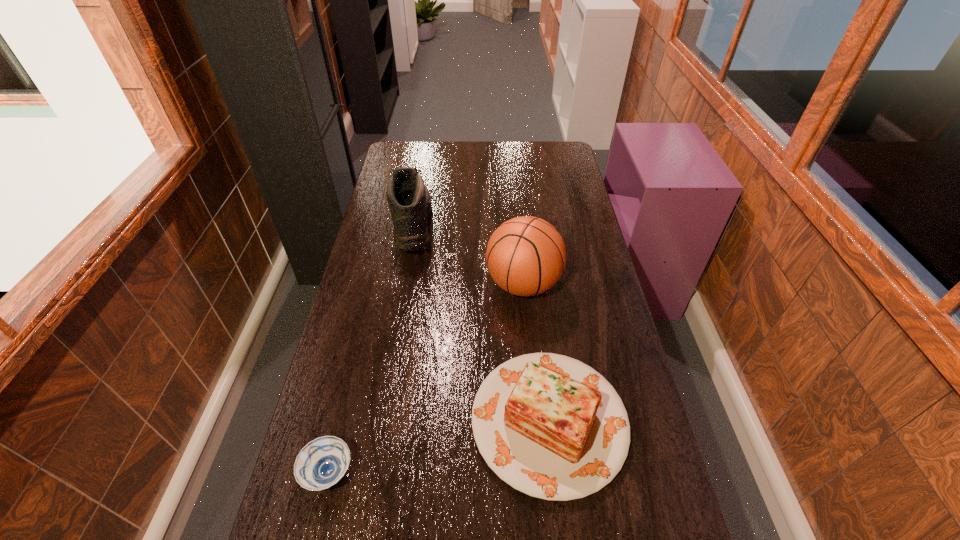
The image size is (960, 540). Identify the location of free space between the basketball and the ski boot. (468, 255).

This screenshot has width=960, height=540. I want to click on empty location between the ski boot and the soup bowl, so click(370, 349).

I want to click on vacant space in between the third tallest object and the soup bowl, so click(439, 447).

Where is `unoccupied area between the basketball and the lasagna`? The height and width of the screenshot is (540, 960). unoccupied area between the basketball and the lasagna is located at coordinates (536, 353).

Locate an element on the screen. The width and height of the screenshot is (960, 540). vacant space that is in between the ski boot and the basketball is located at coordinates (468, 255).

In order to click on object that can be found as the closest to the shortest object in this screenshot , I will do `click(550, 426)`.

Locate which object ranks second in proximity to the ski boot. Please provide its 2D coordinates. Your answer should be formatted as a tuple, i.e. [(x, y)], where the tuple contains the x and y coordinates of a point satisfying the conditions above.

[(550, 426)]

Find the location of a particular element. free location that satisfies the following two spatial constraints: 1. on the back side of the shortest object; 2. on the left side of the basketball is located at coordinates (372, 285).

Locate an element on the screen. blank area in the image that satisfies the following two spatial constraints: 1. on the front side of the basketball; 2. on the right side of the ski boot is located at coordinates (401, 285).

This screenshot has width=960, height=540. Find the location of `blank area in the image that satisfies the following two spatial constraints: 1. on the back side of the soup bowl; 2. on the right side of the ski boot`. blank area in the image that satisfies the following two spatial constraints: 1. on the back side of the soup bowl; 2. on the right side of the ski boot is located at coordinates (387, 226).